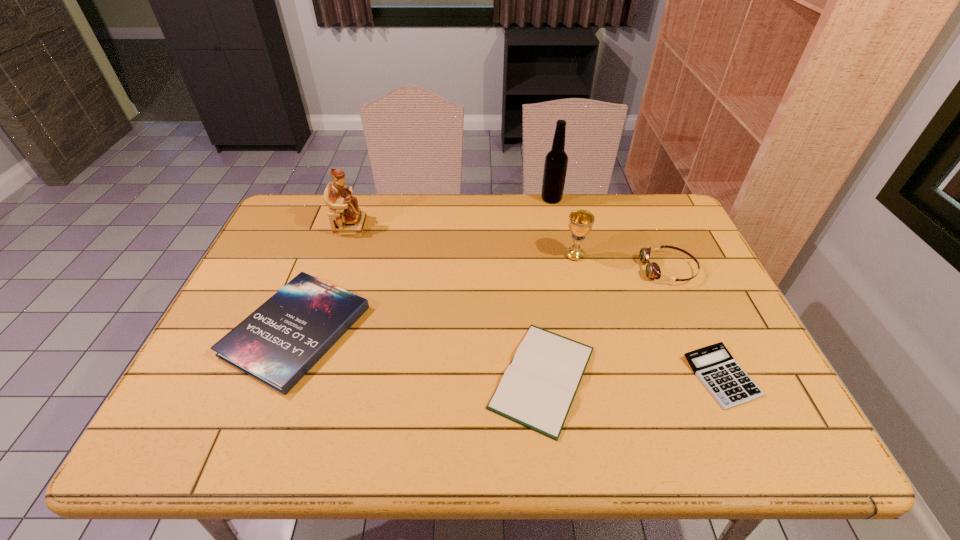
Identify the location of free spot located 0.110m on the left of the beer bottle. (510, 199).

Image resolution: width=960 pixels, height=540 pixels. Identify the location of free spot located 0.140m on the front-facing side of the figurine. (408, 225).

The height and width of the screenshot is (540, 960). Identify the location of free space located 0.110m on the front of the chalice. (583, 290).

The width and height of the screenshot is (960, 540). What are the coordinates of `vacant region located 0.180m through the lenses of the goggles` in the screenshot? It's located at (581, 269).

Where is `vacant space located through the lenses of the goggles`? The width and height of the screenshot is (960, 540). vacant space located through the lenses of the goggles is located at coordinates (533, 269).

You are a GUI agent. You are given a task and a screenshot of the screen. Output one action in this format:
    pyautogui.click(x=<x>, y=<y>)
    Task: Click on the free space located 0.130m through the lenses of the goggles
    
    Given the screenshot: What is the action you would take?
    pyautogui.click(x=598, y=269)

You are a GUI agent. You are given a task and a screenshot of the screen. Output one action in this format:
    pyautogui.click(x=<x>, y=<y>)
    Task: Click on the vacant space located 0.070m on the back of the taller hardback book
    The width and height of the screenshot is (960, 540).
    Given the screenshot: What is the action you would take?
    pyautogui.click(x=323, y=263)

Where is `vacant space located on the right of the shorter hardback book`? The width and height of the screenshot is (960, 540). vacant space located on the right of the shorter hardback book is located at coordinates (721, 377).

Image resolution: width=960 pixels, height=540 pixels. I want to click on free space located on the left of the shortest object, so click(517, 376).

I want to click on beer bottle situated at the far edge, so click(555, 168).